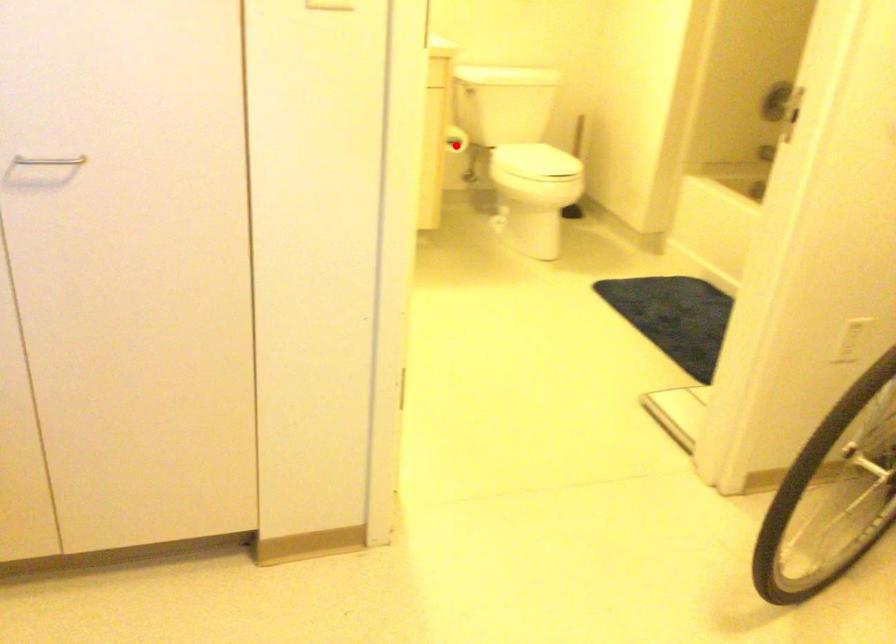
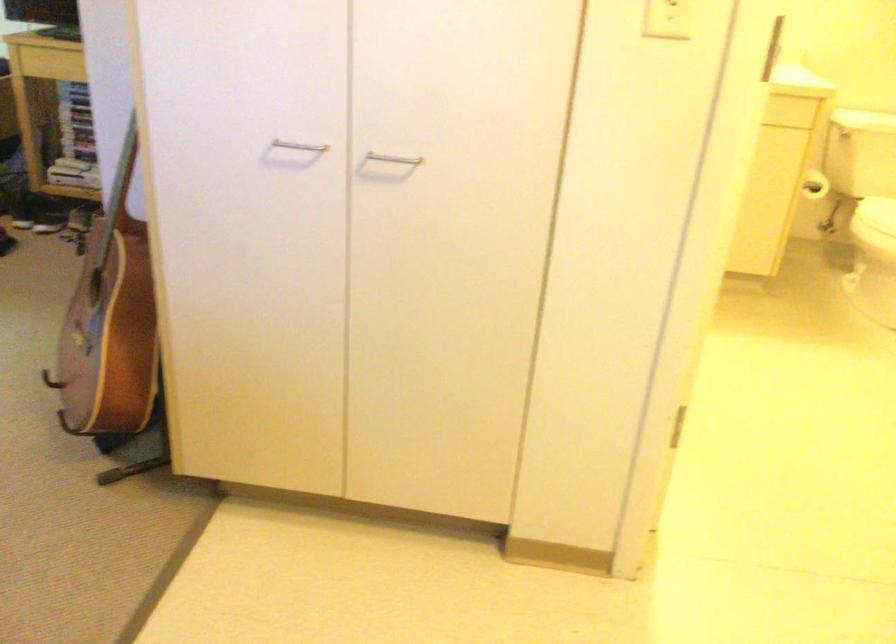
Question: I am providing you with two images of the same scene from different viewpoints. A red point is shown in image1. For the corresponding object point in image2, is it positioned nearer or farther from the camera?

Choices:
 (A) Nearer
 (B) Farther

Answer: (A)